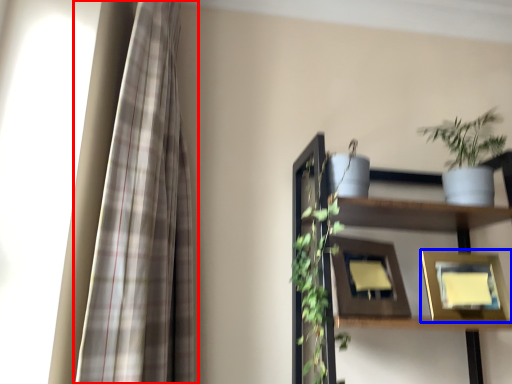
Question: Which object is closer to the camera taking this photo, curtain (highlighted by a red box) or picture frame (highlighted by a blue box)?

Choices:
 (A) curtain
 (B) picture frame

Answer: (A)